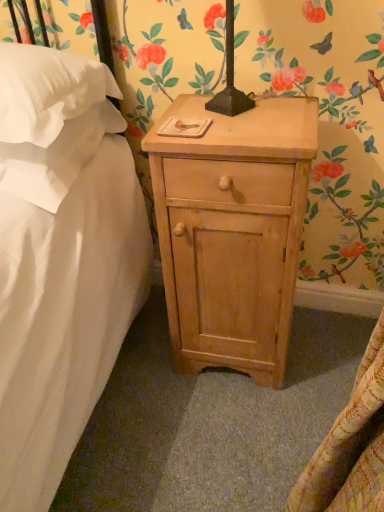
Find the location of a particular element. free space above natural wood nightstand at center (from a real-world perspective) is located at coordinates (237, 121).